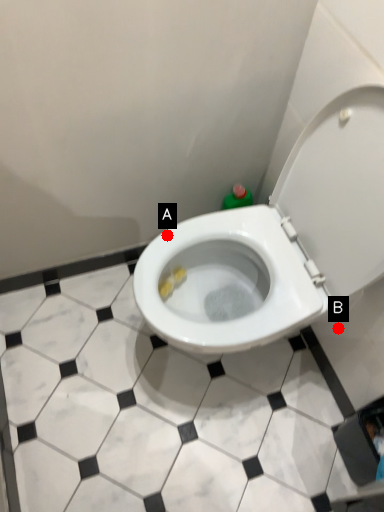
Question: Two points are circled on the image, labeled by A and B beside each circle. Which of the following is the farthest from the observer?

Choices:
 (A) A is further
 (B) B is further

Answer: (B)